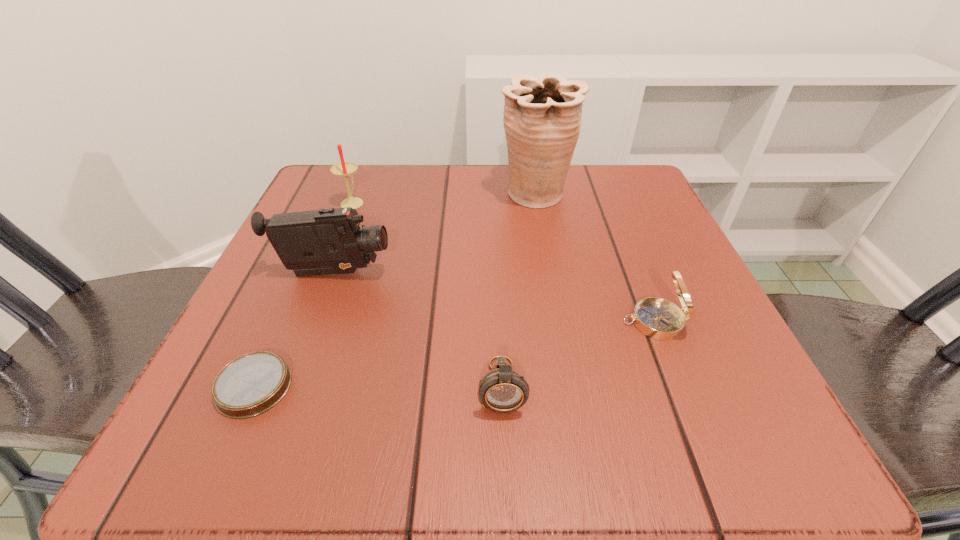
Choose which object is the fifth nearest neighbor to the urn. Please provide its 2D coordinates. Your answer should be formatted as a tuple, i.e. [(x, y)], where the tuple contains the x and y coordinates of a point satisfying the conditions above.

[(250, 385)]

Identify the location of compass that is the nearest to the candle. (250, 385).

Choose which compass is the second nearest neighbor to the farthest compass. Please provide its 2D coordinates. Your answer should be formatted as a tuple, i.e. [(x, y)], where the tuple contains the x and y coordinates of a point satisfying the conditions above.

[(250, 385)]

Identify the location of vacant space that satisfies the following two spatial constraints: 1. with the dial facing the fourth farthest object; 2. on the face of the second compass from right to left. (680, 386).